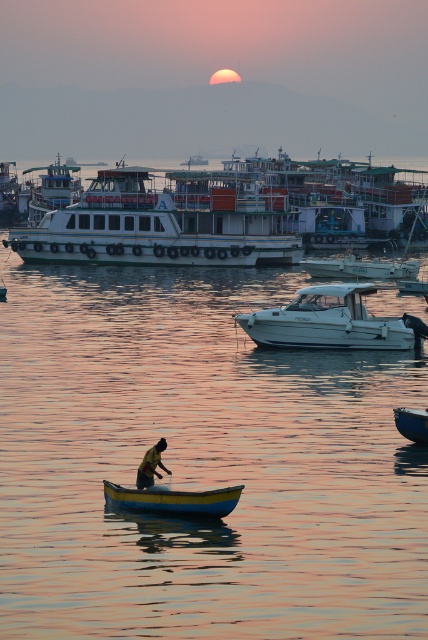
Question: Which object is the farthest from the yellow polished wood canoe at lower center?

Choices:
 (A) white glossy motorboat at center
 (B) yellow fabric shirt at lower center

Answer: (A)

Question: Which object appears closest to the camera in this image?

Choices:
 (A) smooth blue boat at lower right
 (B) yellow polished wood canoe at lower center

Answer: (B)

Question: Can you confirm if white glossy boat at center is bigger than smooth blue boat at lower right?

Choices:
 (A) no
 (B) yes

Answer: (B)

Question: Which is farther from the yellow fabric shirt at lower center?

Choices:
 (A) yellow polished wood canoe at lower center
 (B) white glossy boat at center

Answer: (B)

Question: Where is white glossy ferry at center located in relation to smooth blue boat at lower right in the image?

Choices:
 (A) below
 (B) above

Answer: (B)

Question: From the image, what is the correct spatial relationship of yellow polished wood canoe at lower center in relation to yellow fabric shirt at lower center?

Choices:
 (A) above
 (B) below

Answer: (B)